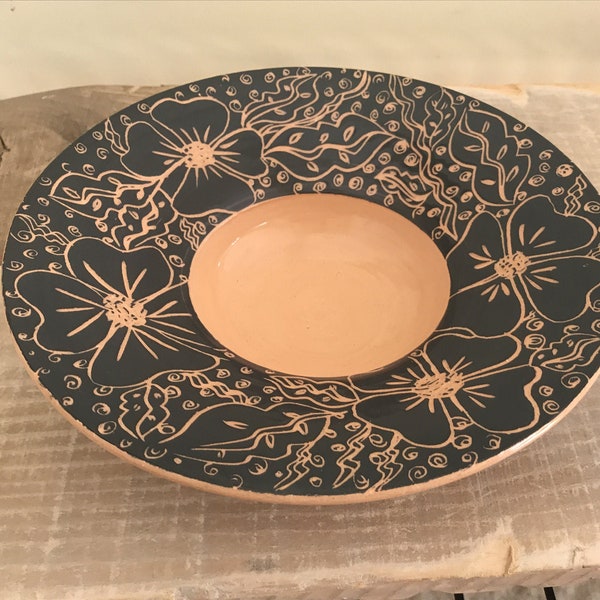
Identify the location of spot on floor/wall. (12, 10).